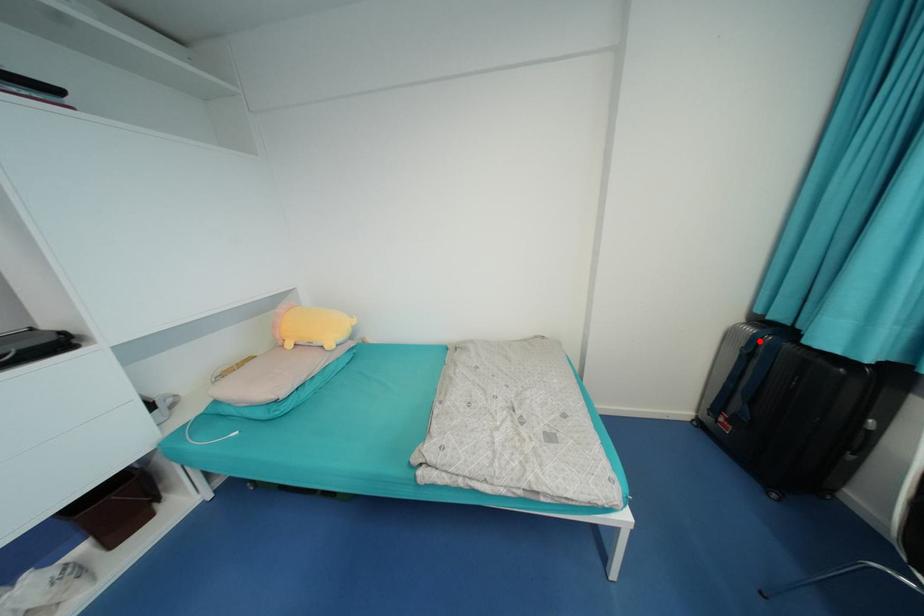
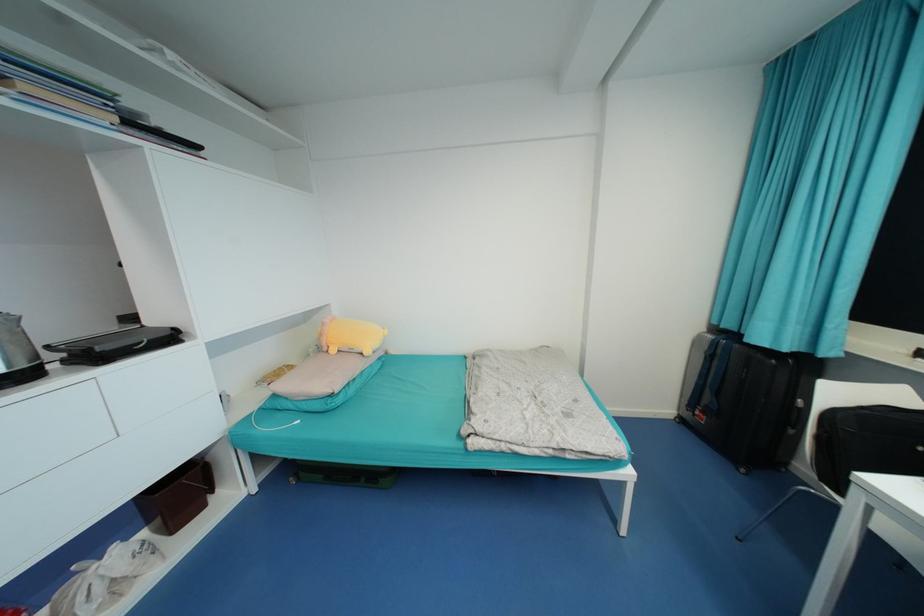
The point at the highlighted location is marked in the first image. Where is the corresponding point in the second image?

(719, 345)